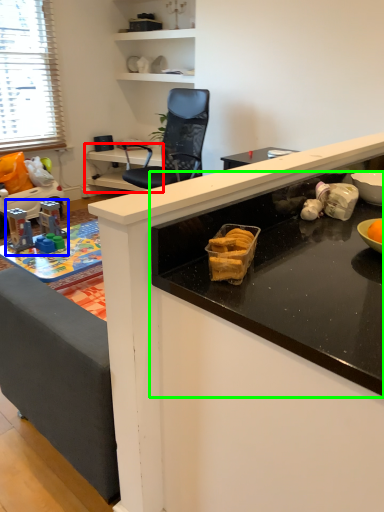
Question: Which is farther away from table (highlighted by a red box)? toy (highlighted by a blue box) or countertop (highlighted by a green box)?

Choices:
 (A) toy
 (B) countertop

Answer: (B)